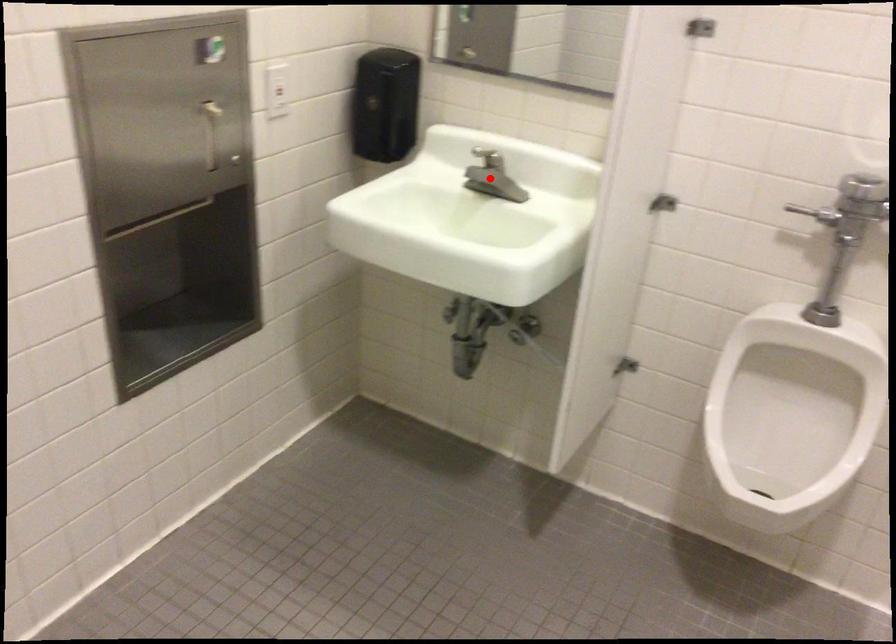
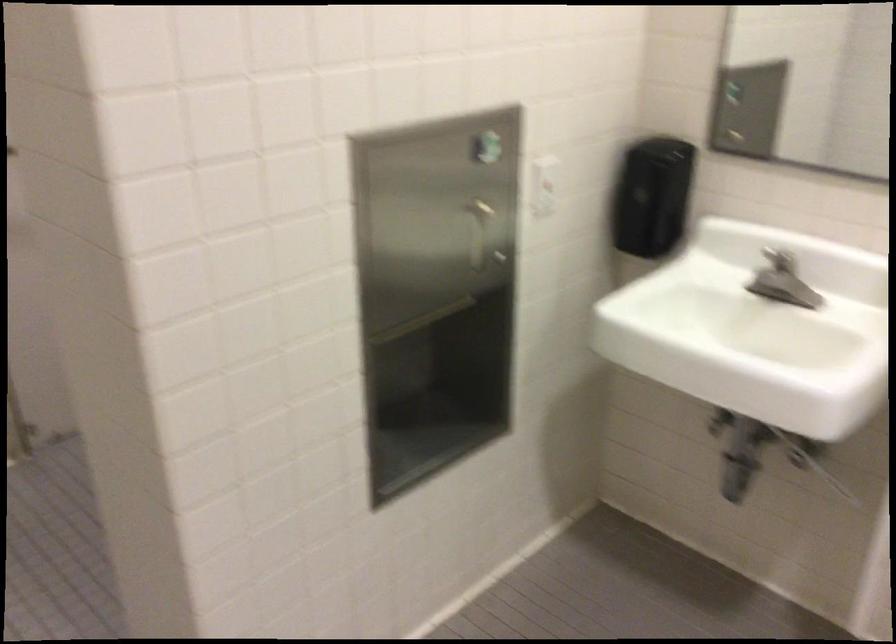
Question: A red point is marked in image1. In image2, is the corresponding 3D point closer to the camera or farther? Reply with the corresponding letter.

Choices:
 (A) The corresponding 3D point is closer.
 (B) The corresponding 3D point is farther.

Answer: (A)